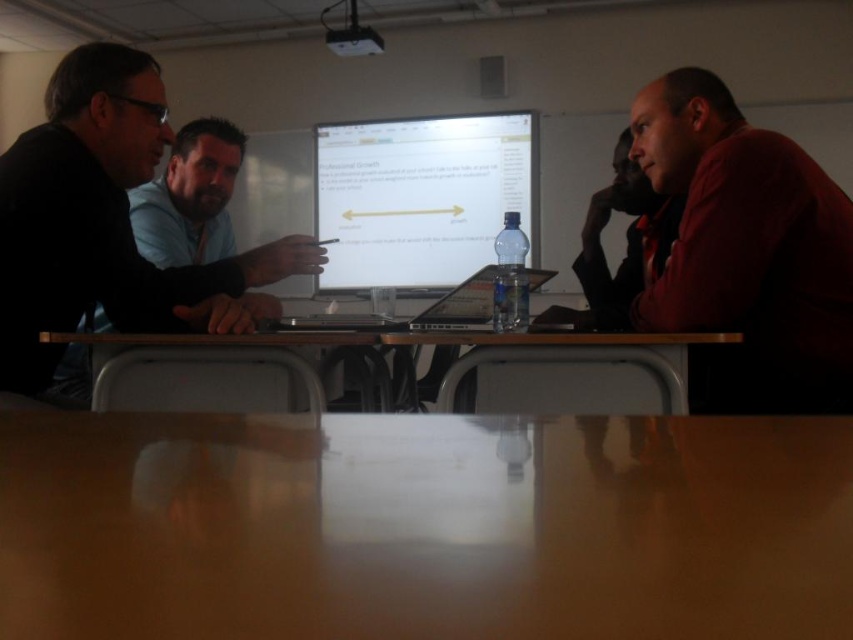
Can you confirm if white glossy computer monitor at center is bigger than smooth wooden table at center?

Correct, white glossy computer monitor at center is larger in size than smooth wooden table at center.

Is white glossy computer monitor at center shorter than smooth wooden table at center?

Incorrect, white glossy computer monitor at center's height does not fall short of smooth wooden table at center's.

You are a GUI agent. You are given a task and a screenshot of the screen. Output one action in this format:
    pyautogui.click(x=<x>, y=<y>)
    Task: Click on the white glossy computer monitor at center
    
    Given the screenshot: What is the action you would take?
    pyautogui.click(x=421, y=196)

Is glossy plastic table at center above white glossy computer monitor at center?

No, glossy plastic table at center is not above white glossy computer monitor at center.

Which is below, glossy plastic table at center or white glossy computer monitor at center?

glossy plastic table at center

Image resolution: width=853 pixels, height=640 pixels. Identify the location of glossy plastic table at center. (425, 525).

Who is lower down, glossy plastic table at center or matte black laptop at left?

glossy plastic table at center is lower down.

Is point (631, 634) positioned before point (50, 173)?

Yes, point (631, 634) is closer to viewer.

Is point (218, 513) positioned before point (83, 285)?

Yes, it is in front of point (83, 285).

You are a GUI agent. You are given a task and a screenshot of the screen. Output one action in this format:
    pyautogui.click(x=<x>, y=<y>)
    Task: Click on the glossy plastic table at center
    The image size is (853, 640).
    Given the screenshot: What is the action you would take?
    pyautogui.click(x=425, y=525)